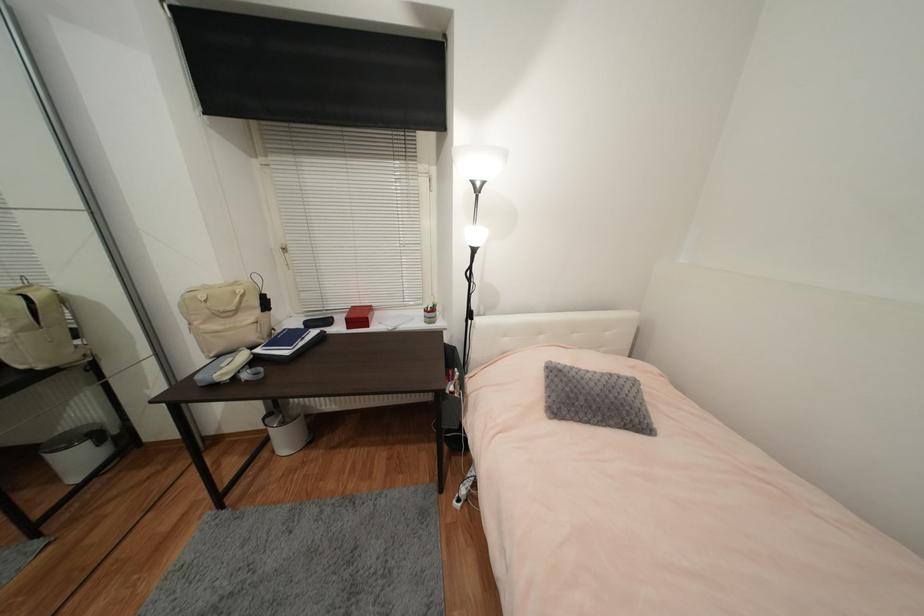
Where is `lamp switch knob`? The width and height of the screenshot is (924, 616). lamp switch knob is located at coordinates (478, 313).